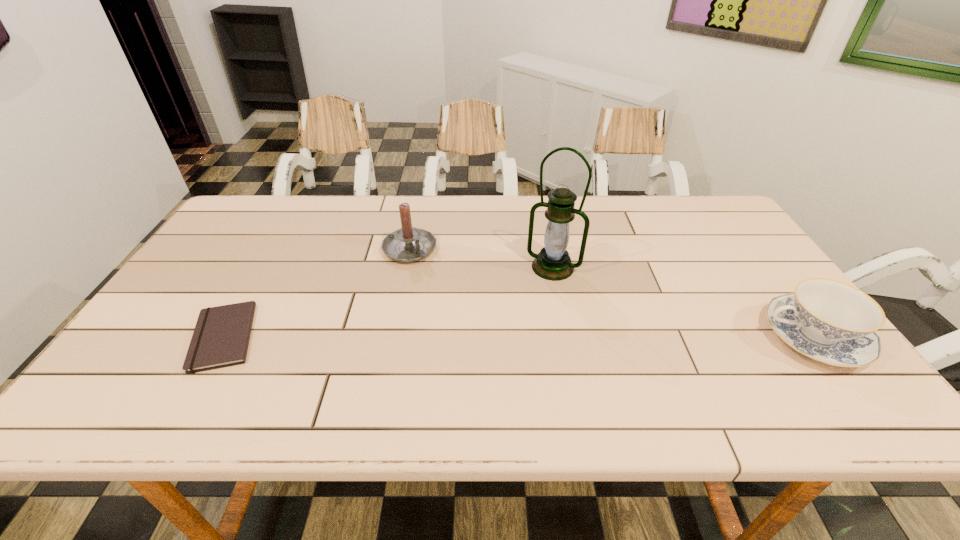
This screenshot has width=960, height=540. I want to click on object that is the second closest to the third tallest object, so click(x=408, y=244).

At what (x,y) coordinates should I click in order to perform the action: click on the closest object relative to the candle. Please return your answer as a coordinate pair (x, y). The image size is (960, 540). Looking at the image, I should click on (553, 262).

What are the coordinates of `free location that satisfies the following two spatial constraints: 1. on the back side of the rightmost object; 2. with the handle on the side of the checkbook` in the screenshot? It's located at (225, 337).

The width and height of the screenshot is (960, 540). I want to click on free location that satisfies the following two spatial constraints: 1. on the front side of the chinaware; 2. with the handle on the side of the lantern, so click(566, 337).

At what (x,y) coordinates should I click in order to perform the action: click on free space that satisfies the following two spatial constraints: 1. on the front side of the candle; 2. on the right side of the tallest object. Please return your answer as a coordinate pair (x, y). Image resolution: width=960 pixels, height=540 pixels. Looking at the image, I should click on (x=406, y=267).

I want to click on vacant position in the image that satisfies the following two spatial constraints: 1. on the front side of the second object from right to left; 2. with the handle on the side of the chinaware, so click(x=566, y=337).